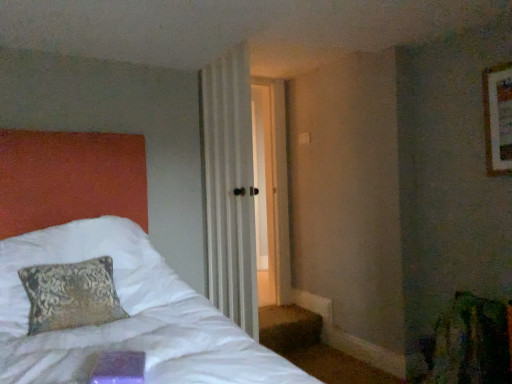
Question: Is white striped curtain at center taller or shorter than wooden frame at upper right?

Choices:
 (A) tall
 (B) short

Answer: (A)

Question: Is white striped curtain at center inside or outside of wooden frame at upper right?

Choices:
 (A) outside
 (B) inside

Answer: (A)

Question: Is white striped curtain at center wider or thinner than wooden frame at upper right?

Choices:
 (A) thin
 (B) wide

Answer: (B)

Question: Is wooden frame at upper right taller or shorter than white striped curtain at center?

Choices:
 (A) tall
 (B) short

Answer: (B)

Question: Which is correct: wooden frame at upper right is inside white striped curtain at center, or outside of it?

Choices:
 (A) outside
 (B) inside

Answer: (A)

Question: Is point (498, 96) positioned closer to the camera than point (218, 276)?

Choices:
 (A) closer
 (B) farther

Answer: (A)

Question: From a real-world perspective, relative to white striped curtain at center, is wooden frame at upper right vertically above or below?

Choices:
 (A) above
 (B) below

Answer: (A)